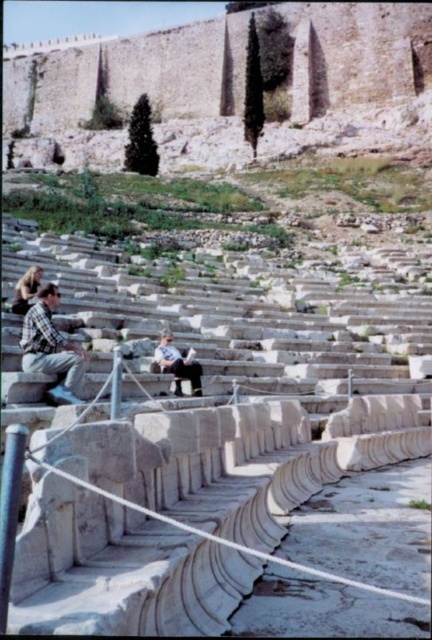
You are standing at the entrance of the ancient stone amphitheater and see two points marked as point (57, 356) and point (200, 374). Which point is closer to you?

Point (57, 356) is in front of point (200, 374), so it is closer to you.

You are standing at the point labeled point (x=73, y=365) in the amphitheater. If you want to take a photo of the entire amphitheater from your current position, will you be able to capture it all in one frame without moving? Please explain your reasoning based on the distance between you and the camera.

The point labeled point (x=73, y=365) is 34.76 meters away from the camera. Since the amphitheater is large and the distance is significant, it might be challenging to capture the entire structure in one frame without moving. However, using a wide angle lens could help include more of the scene in the photo.